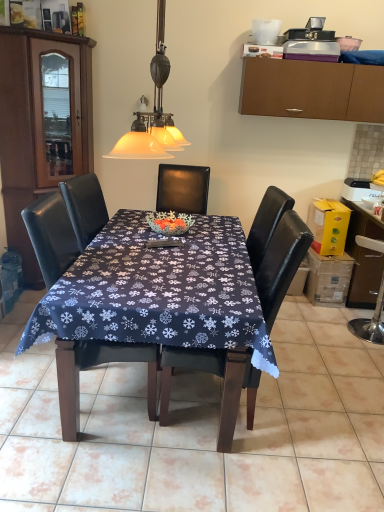
Question: From a real-world perspective, does dark blue fabric at center stand above black leather chair at center, arranged as the 1th chair when viewed from the left?

Choices:
 (A) yes
 (B) no

Answer: (B)

Question: Is black leather chair at center, the 2th chair in the right-to-left sequence, a part of dark blue fabric at center?

Choices:
 (A) no
 (B) yes

Answer: (A)

Question: Considering the relative sizes of dark blue fabric at center and black leather chair at center, arranged as the 1th chair when viewed from the left, in the image provided, is dark blue fabric at center shorter than black leather chair at center, arranged as the 1th chair when viewed from the left,?

Choices:
 (A) no
 (B) yes

Answer: (B)

Question: Does dark blue fabric at center turn towards black leather chair at center, arranged as the 1th chair when viewed from the left?

Choices:
 (A) no
 (B) yes

Answer: (A)

Question: From the image's perspective, is dark blue fabric at center located beneath black leather chair at center, the 2th chair in the right-to-left sequence?

Choices:
 (A) no
 (B) yes

Answer: (B)

Question: In terms of height, does dark blue fabric tablecloth at center look taller or shorter compared to black leather chair at center, the 2th chair in the right-to-left sequence?

Choices:
 (A) tall
 (B) short

Answer: (B)

Question: Considering the positions of dark blue fabric tablecloth at center and black leather chair at center, arranged as the 1th chair when viewed from the left, in the image, is dark blue fabric tablecloth at center bigger or smaller than black leather chair at center, arranged as the 1th chair when viewed from the left,?

Choices:
 (A) small
 (B) big

Answer: (B)

Question: Is dark blue fabric tablecloth at center situated inside black leather chair at center, the 2th chair in the right-to-left sequence, or outside?

Choices:
 (A) inside
 (B) outside

Answer: (B)

Question: Relative to black leather chair at center, arranged as the 1th chair when viewed from the left, is dark blue fabric tablecloth at center in front or behind?

Choices:
 (A) behind
 (B) front

Answer: (B)

Question: Is metallic silver swivel chair at right bigger or smaller than brown wood cabinet at left, which ranks as the first cabinetry in left-to-right order?

Choices:
 (A) big
 (B) small

Answer: (B)

Question: Visually, is metallic silver swivel chair at right positioned to the left or to the right of brown wood cabinet at left, positioned as the 2th cabinetry in right-to-left order?

Choices:
 (A) left
 (B) right

Answer: (B)

Question: In the image, is metallic silver swivel chair at right positioned in front of or behind brown wood cabinet at left, which ranks as the first cabinetry in left-to-right order?

Choices:
 (A) front
 (B) behind

Answer: (B)

Question: Would you say metallic silver swivel chair at right is inside or outside brown wood cabinet at left, positioned as the 2th cabinetry in right-to-left order?

Choices:
 (A) outside
 (B) inside

Answer: (A)

Question: In terms of size, does dark blue fabric at center appear bigger or smaller than black leather chair at center, arranged as the 1th chair when viewed from the left?

Choices:
 (A) small
 (B) big

Answer: (A)

Question: In terms of height, does dark blue fabric at center look taller or shorter compared to black leather chair at center, arranged as the 1th chair when viewed from the left?

Choices:
 (A) tall
 (B) short

Answer: (B)